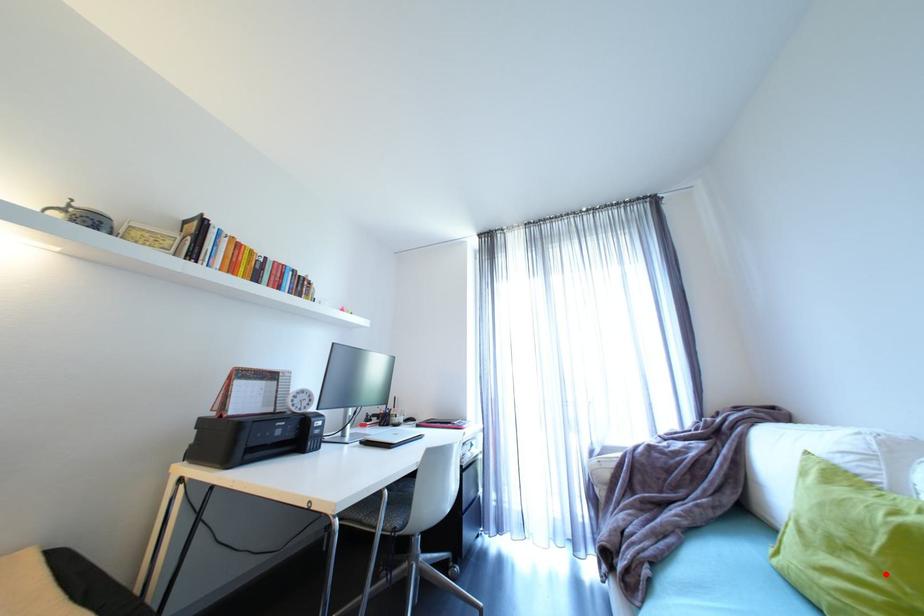
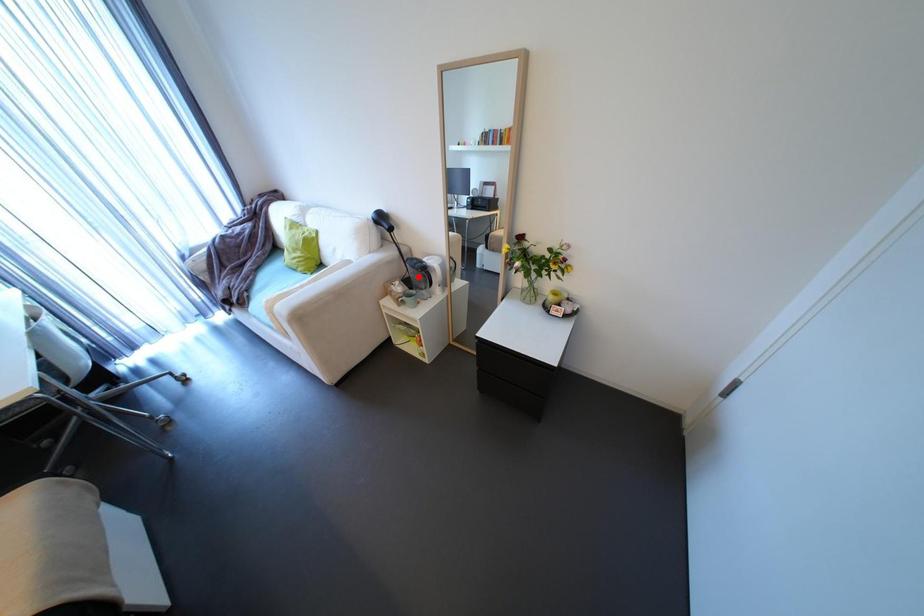
I am providing you with two images of the same scene from different viewpoints. A red point is marked on the first image and another point is marked on the second image. Is the marked point in image1 the same physical position as the marked point in image2?

No